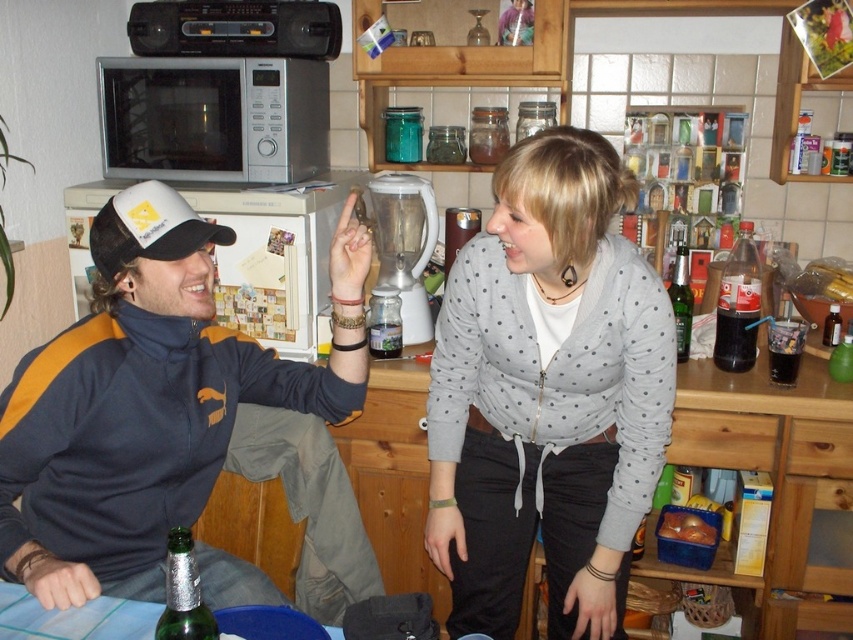
Question: Considering the real-world distances, which object is farthest from the dark glass bottle at right?

Choices:
 (A) matte blue jacket at center-left
 (B) green glass bottle at lower left
 (C) gray dotted cardigan at center
 (D) silver metallic microwave at upper left

Answer: (B)

Question: Which point is farther to the camera?

Choices:
 (A) green glass jar at upper center
 (B) gray dotted cardigan at center

Answer: (A)

Question: Which point is closer to the camera?

Choices:
 (A) (106, 241)
 (B) (726, 294)
 (C) (621, 344)
 (D) (689, 298)

Answer: (A)

Question: Where is white mesh baseball cap at upper left located in relation to white plastic blender at center in the image?

Choices:
 (A) above
 (B) below

Answer: (A)

Question: In this image, where is green glass jar at upper center located relative to translucent plastic cup at right?

Choices:
 (A) left
 (B) right

Answer: (A)

Question: Observing the image, what is the correct spatial positioning of white matte microwave at upper left in reference to white plastic blender at center?

Choices:
 (A) above
 (B) below

Answer: (A)